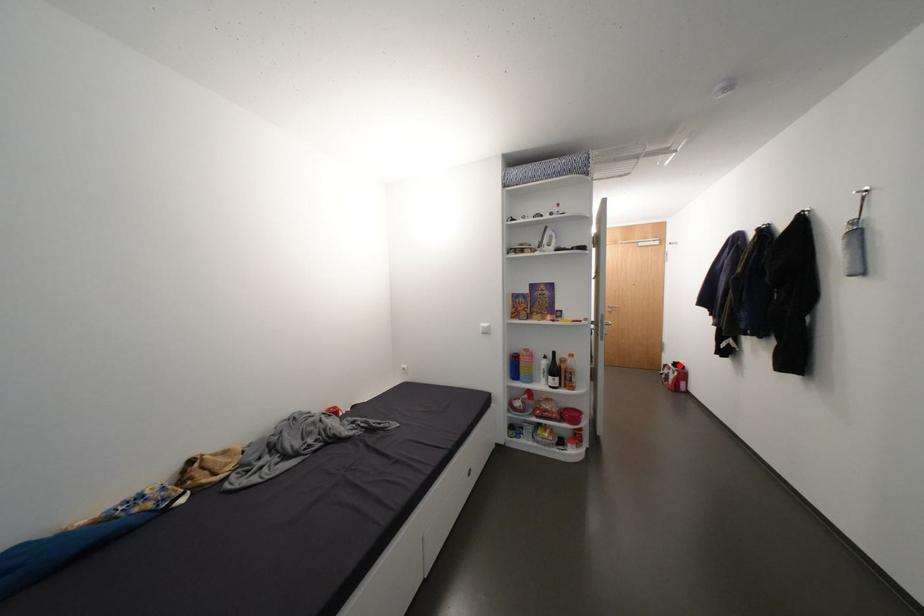
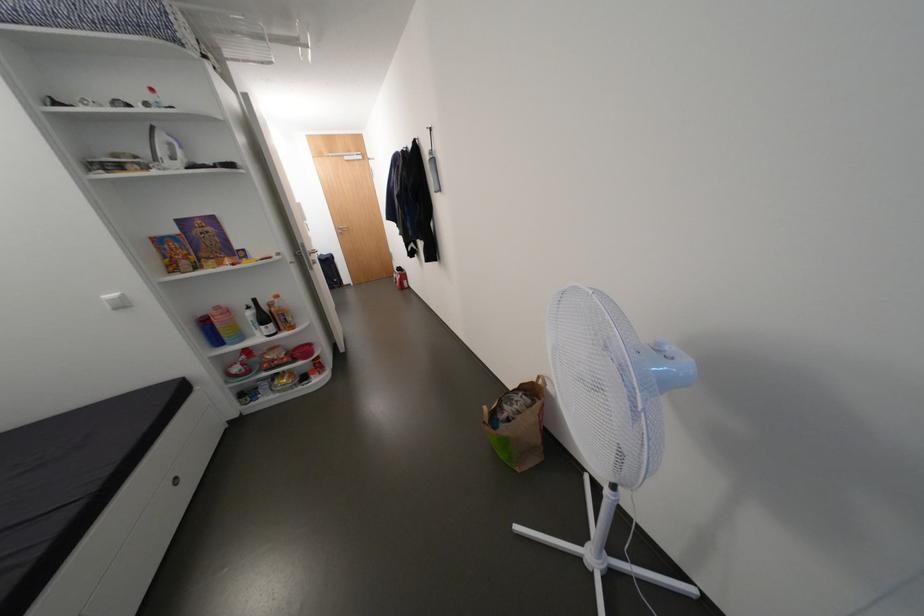
Find the pixel in the second image that matches the highlighted location in the first image.

(405, 270)